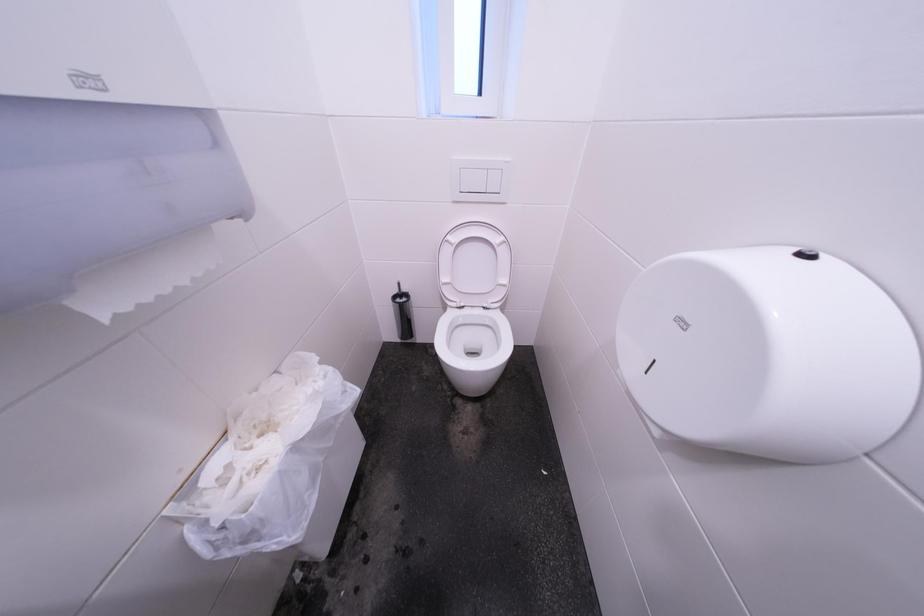
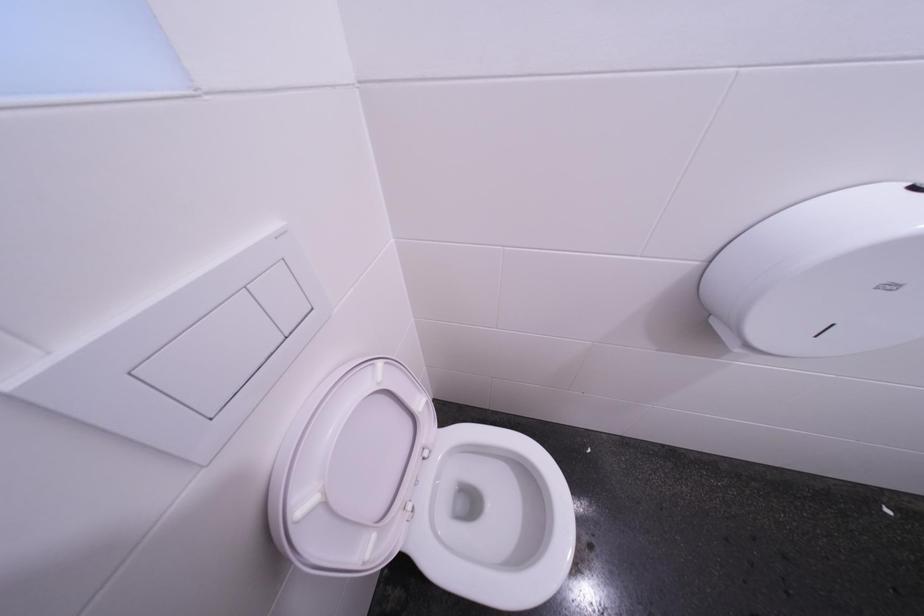
How did the camera likely rotate?

The camera rotated toward right-down.